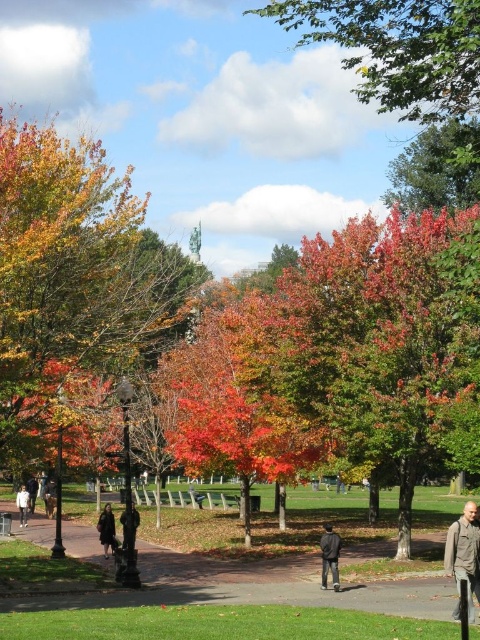
Is gray fabric jacket at lower right shorter than white cotton jacket at lower left?

No, gray fabric jacket at lower right is not shorter than white cotton jacket at lower left.

Is gray fabric jacket at lower right further to the viewer compared to white cotton jacket at lower left?

No, gray fabric jacket at lower right is closer to the viewer.

I want to click on gray fabric jacket at lower right, so click(x=464, y=552).

At what (x,y) coordinates should I click in order to perform the action: click on gray fabric jacket at lower right. Please return your answer as a coordinate pair (x, y). The height and width of the screenshot is (640, 480). Looking at the image, I should click on (464, 552).

Which of these two, dark gray jacket at lower center or white cotton jacket at lower left, stands taller?

Standing taller between the two is dark gray jacket at lower center.

Does dark gray jacket at lower center have a smaller size compared to white cotton jacket at lower left?

Yes.

Which is in front, point (325, 576) or point (29, 502)?

Point (325, 576) is in front.

Where is `dark gray jacket at lower center`? The width and height of the screenshot is (480, 640). dark gray jacket at lower center is located at coordinates (330, 556).

Does point (111, 541) come behind point (23, 512)?

No, it is in front of (23, 512).

Who is shorter, dark brown leather coat at lower center or white cotton jacket at lower left?

white cotton jacket at lower left

Locate an element on the screen. dark brown leather coat at lower center is located at coordinates (107, 529).

Where is `dark brown leather coat at lower center`? The image size is (480, 640). dark brown leather coat at lower center is located at coordinates (107, 529).